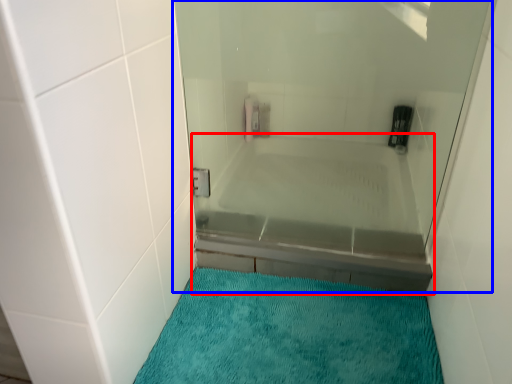
Question: Which point is further to the camera, bathtub (highlighted by a red box) or shower door (highlighted by a blue box)?

Choices:
 (A) bathtub
 (B) shower door

Answer: (A)